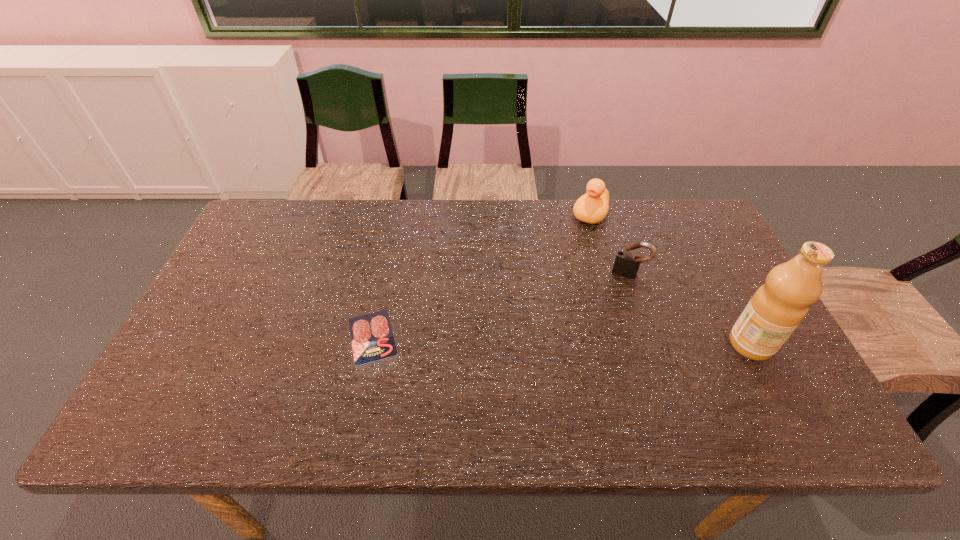
I want to click on free space between the olive oil and the shortest object, so click(x=562, y=340).

Where is `free space between the tallest object and the third nearest object`? free space between the tallest object and the third nearest object is located at coordinates (689, 309).

Select which object is the closest to the shortest object. Please provide its 2D coordinates. Your answer should be formatted as a tuple, i.e. [(x, y)], where the tuple contains the x and y coordinates of a point satisfying the conditions above.

[(626, 264)]

Identify which object is the third nearest to the olive oil. Please provide its 2D coordinates. Your answer should be formatted as a tuple, i.e. [(x, y)], where the tuple contains the x and y coordinates of a point satisfying the conditions above.

[(372, 339)]

Locate an element on the screen. The height and width of the screenshot is (540, 960). vacant region that satisfies the following two spatial constraints: 1. on the front side of the tallest object; 2. on the label of the second farthest object is located at coordinates (652, 344).

Identify the location of free location that satisfies the following two spatial constraints: 1. on the front side of the padlock; 2. on the left side of the duck. (607, 274).

I want to click on vacant space that satisfies the following two spatial constraints: 1. on the front side of the duck; 2. on the label of the olive oil, so click(x=627, y=344).

This screenshot has height=540, width=960. Identify the location of vacant space that satisfies the following two spatial constraints: 1. on the front side of the tallest object; 2. on the label of the third nearest object. (652, 344).